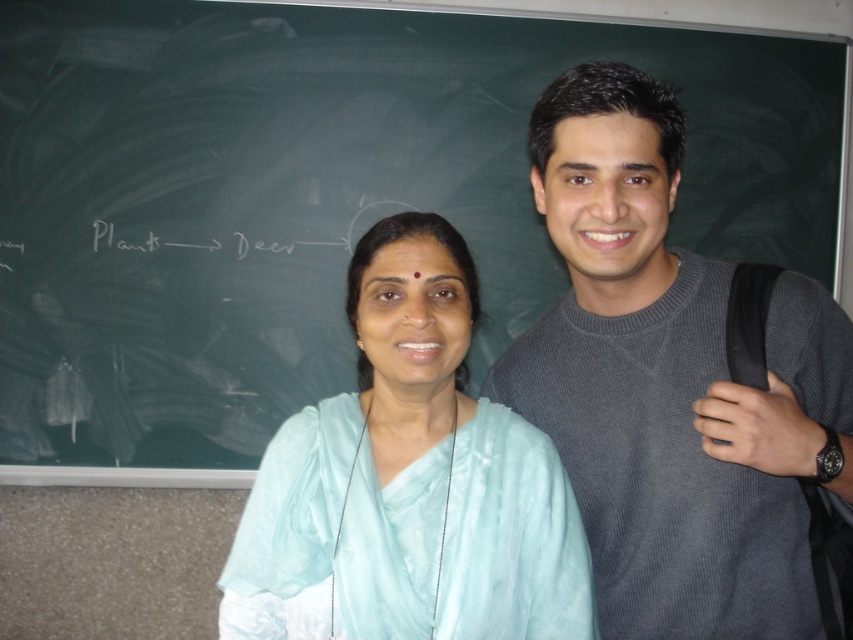
You are standing in front of the chalkboard and want to hand a pen to the person wearing the gray sweater at center. Based on their position, where should you aim to place the pen so they can easily reach it?

The gray sweater at center is located at point (672, 384). To ensure easy reach, place the pen near their position at those coordinates.

You are an observer in the classroom. You notice the gray sweater at center and the light blue silk saree at center. Which clothing item appears wider from your perspective?

The gray sweater at center has a lesser width compared to the light blue silk saree at center, so the light blue silk saree at center appears wider.

You are a photographer trying to capture both the gray sweater at center and the light blue silk saree at center in a single frame. Given that your camera has a focal length of 50mm and a sensor size of 24mm x 36mm, what is the minimum distance you need to stand from the subjects to ensure both are fully in focus?

The minimum distance required is calculated using the hyperfocal distance formula, but since the objects are 8.29 inches apart and both need to be in focus, you should ensure the camera is focused at the midpoint between them. However, without specific aperture and acceptable circle of confusion values, an exact distance can only be estimated. A safe starting point would be to stand approximately 10 feet away to accommodate the 8.29 inch separation between the gray sweater at center and the light blue silk.